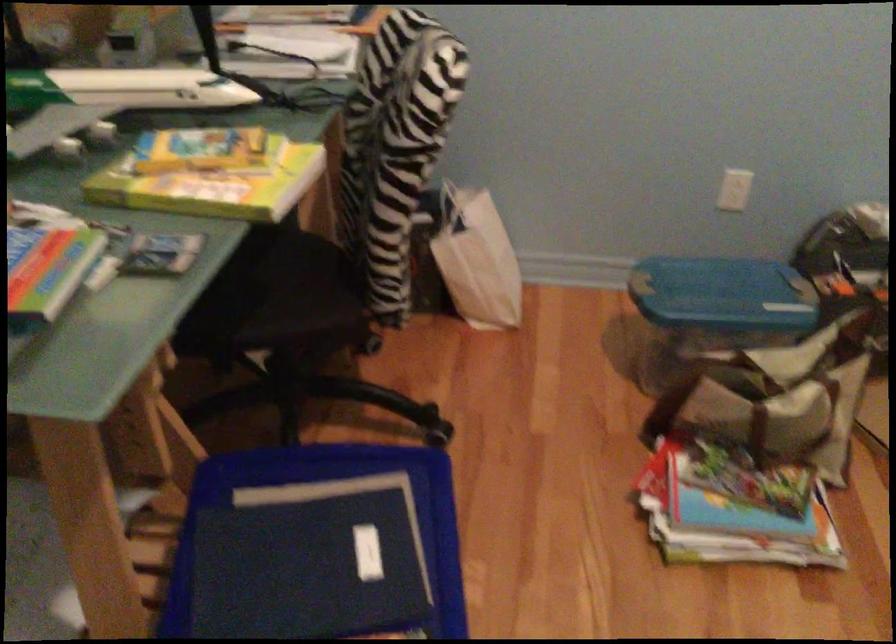
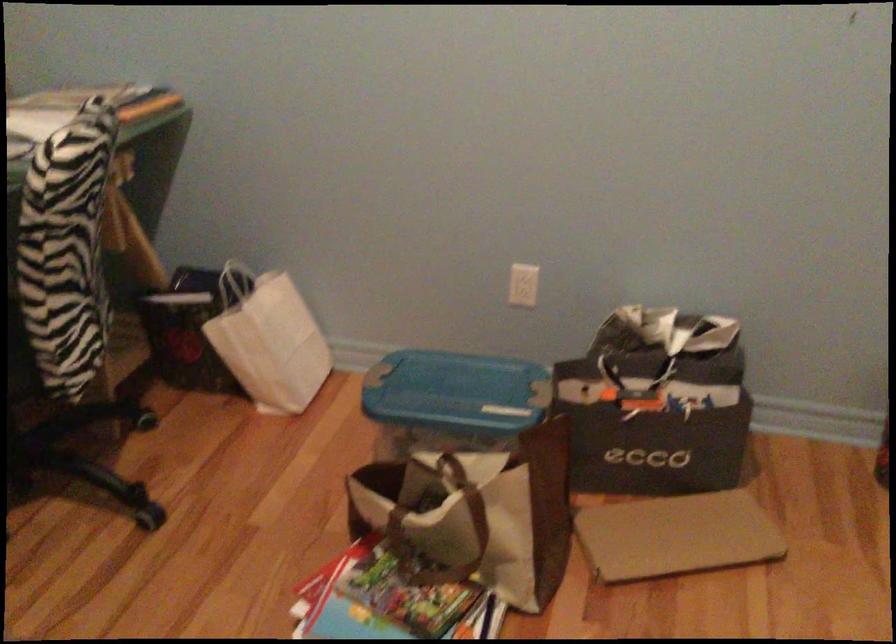
The point at [728,292] is marked in the first image. Where is the corresponding point in the second image?

(455, 393)